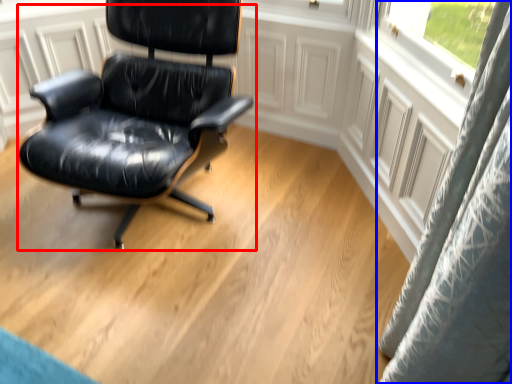
Question: Among these objects, which one is nearest to the camera, chair (highlighted by a red box) or curtain (highlighted by a blue box)?

Choices:
 (A) chair
 (B) curtain

Answer: (A)